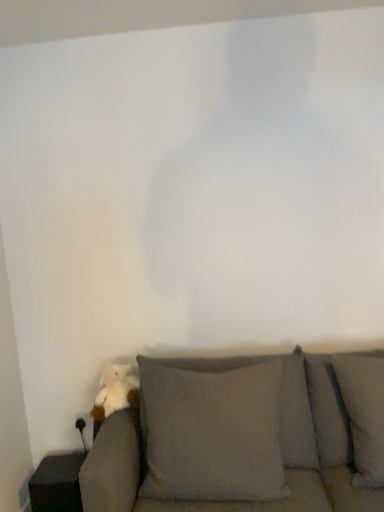
Where is `white plush toy at lower left`? white plush toy at lower left is located at coordinates (116, 391).

Measure the distance between point (138, 383) and camera.

Point (138, 383) is 6.61 feet from camera.

This screenshot has width=384, height=512. What do you see at coordinates (116, 391) in the screenshot?
I see `white plush toy at lower left` at bounding box center [116, 391].

Measure the distance between gray fabric couch at lower left and camera.

The distance of gray fabric couch at lower left from camera is 5.07 feet.

This screenshot has height=512, width=384. What are the coordinates of `gray fabric couch at lower left` in the screenshot? It's located at (244, 438).

What do you see at coordinates (244, 438) in the screenshot? Image resolution: width=384 pixels, height=512 pixels. I see `gray fabric couch at lower left` at bounding box center [244, 438].

Locate an element on the screen. This screenshot has width=384, height=512. white plush toy at lower left is located at coordinates (116, 391).

Visually, is white plush toy at lower left positioned to the left or to the right of gray fabric couch at lower left?

In the image, white plush toy at lower left appears on the left side of gray fabric couch at lower left.

Between white plush toy at lower left and gray fabric couch at lower left, which one is positioned behind?

white plush toy at lower left is further away from the camera.

Which is more distant, [122,382] or [252,489]?

The point [122,382] is farther.

From the image's perspective, is white plush toy at lower left above or below gray fabric couch at lower left?

white plush toy at lower left is situated higher than gray fabric couch at lower left in the image.

From a real-world perspective, is white plush toy at lower left positioned over gray fabric couch at lower left based on gravity?

Yes, from a real-world perspective, white plush toy at lower left is over gray fabric couch at lower left

Considering the sizes of white plush toy at lower left and gray fabric couch at lower left in the image, is white plush toy at lower left wider or thinner than gray fabric couch at lower left?

Clearly, white plush toy at lower left has less width compared to gray fabric couch at lower left.

Considering the sizes of white plush toy at lower left and gray fabric couch at lower left in the image, is white plush toy at lower left taller or shorter than gray fabric couch at lower left?

In the image, white plush toy at lower left appears to be shorter than gray fabric couch at lower left.

Is white plush toy at lower left bigger or smaller than gray fabric couch at lower left?

Clearly, white plush toy at lower left is smaller in size than gray fabric couch at lower left.

Is white plush toy at lower left located outside gray fabric couch at lower left?

That's incorrect, white plush toy at lower left is not completely outside gray fabric couch at lower left.

Are white plush toy at lower left and gray fabric couch at lower left making contact?

white plush toy at lower left and gray fabric couch at lower left are clearly separated.

Is white plush toy at lower left facing towards gray fabric couch at lower left?

Yes, white plush toy at lower left is facing gray fabric couch at lower left.

Measure the distance between white plush toy at lower left and gray fabric couch at lower left.

white plush toy at lower left is 19.15 inches from gray fabric couch at lower left.

The width and height of the screenshot is (384, 512). I want to click on studio couch that appears below the white plush toy at lower left (from the image's perspective), so click(x=244, y=438).

Is gray fabric couch at lower left to the left of white plush toy at lower left from the viewer's perspective?

No.

Which object is more forward, gray fabric couch at lower left or white plush toy at lower left?

gray fabric couch at lower left is closer to the camera.

Which is behind, point (204, 486) or point (113, 404)?

The point (113, 404) is more distant.

From the image's perspective, between gray fabric couch at lower left and white plush toy at lower left, who is located below?

gray fabric couch at lower left.

From a real-world perspective, relative to white plush toy at lower left, is gray fabric couch at lower left vertically above or below?

Clearly, from a real-world perspective, gray fabric couch at lower left is below white plush toy at lower left.

Considering the sizes of objects gray fabric couch at lower left and white plush toy at lower left in the image provided, who is thinner, gray fabric couch at lower left or white plush toy at lower left?

white plush toy at lower left is thinner.

Between gray fabric couch at lower left and white plush toy at lower left, which one has less height?

Standing shorter between the two is white plush toy at lower left.

Does gray fabric couch at lower left have a larger size compared to white plush toy at lower left?

Correct, gray fabric couch at lower left is larger in size than white plush toy at lower left.

Is gray fabric couch at lower left not within white plush toy at lower left?

Yes, gray fabric couch at lower left is located beyond the bounds of white plush toy at lower left.

Is gray fabric couch at lower left in contact with white plush toy at lower left?

No, gray fabric couch at lower left is not touching white plush toy at lower left.

Looking at this image, is gray fabric couch at lower left facing towards white plush toy at lower left?

No, gray fabric couch at lower left is not oriented towards white plush toy at lower left.

What's the angular difference between gray fabric couch at lower left and white plush toy at lower left's facing directions?

The angular difference between gray fabric couch at lower left and white plush toy at lower left is 4.73 degrees.

Find the location of a particular element. The width and height of the screenshot is (384, 512). toy above the gray fabric couch at lower left (from a real-world perspective) is located at coordinates (116, 391).

In order to click on toy on the left of gray fabric couch at lower left in this screenshot , I will do `click(116, 391)`.

I want to click on studio couch located in front of the white plush toy at lower left, so click(x=244, y=438).